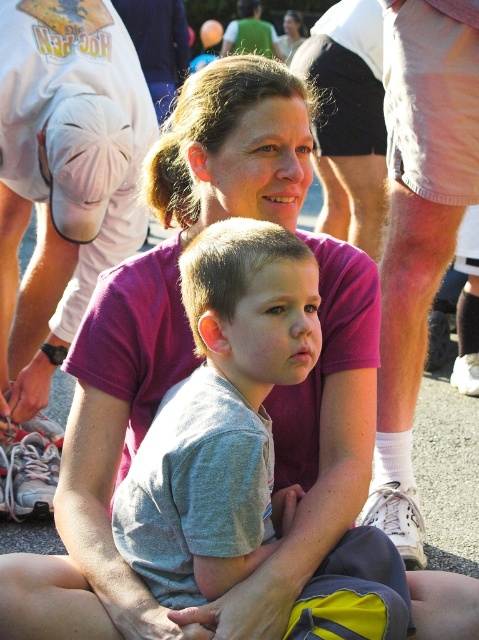
Question: Can you confirm if gray cotton shirt at center is bigger than white cotton shorts at right?

Choices:
 (A) no
 (B) yes

Answer: (A)

Question: Considering the real-world distances, which object is closest to the matte black shorts at center?

Choices:
 (A) gray cotton shirt at center
 (B) white cotton shorts at right
 (C) white cotton shirt at center

Answer: (B)

Question: Which object is closer to the camera taking this photo?

Choices:
 (A) gray cotton shirt at center
 (B) white cotton shorts at right
 (C) matte black shorts at center

Answer: (A)

Question: Does gray cotton shirt at center have a smaller size compared to matte black shorts at center?

Choices:
 (A) yes
 (B) no

Answer: (A)

Question: Which of the following is the farthest from the observer?

Choices:
 (A) gray cotton shirt at center
 (B) matte black shorts at center
 (C) white cotton shirt at center
 (D) white cotton shorts at right

Answer: (B)

Question: Is gray cotton shirt at center closer to the viewer compared to matte black shorts at center?

Choices:
 (A) yes
 (B) no

Answer: (A)